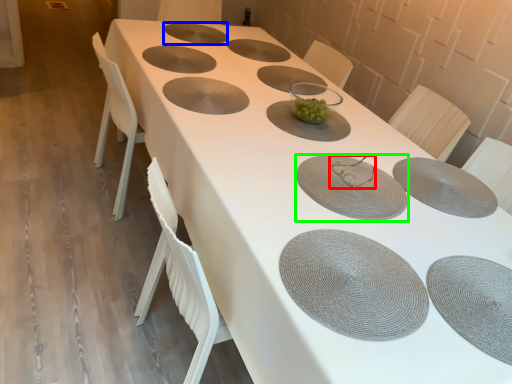
Question: Based on their relative distances, which object is nearer to tableware (highlighted by a red box)? Choose from tableware (highlighted by a blue box) and tableware (highlighted by a green box).

Choices:
 (A) tableware
 (B) tableware

Answer: (B)